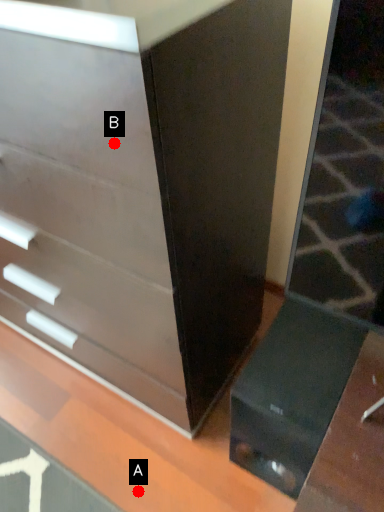
Question: Two points are circled on the image, labeled by A and B beside each circle. Which point is farther to the camera?

Choices:
 (A) A is further
 (B) B is further

Answer: (A)